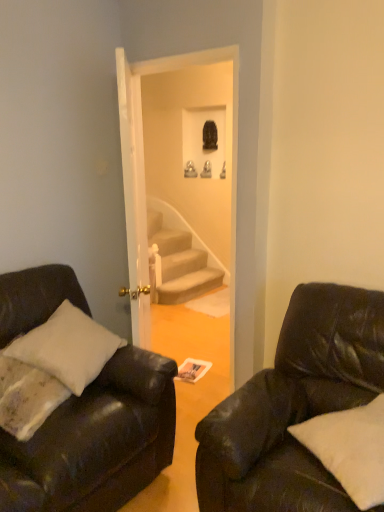
Question: From the image's perspective, would you say matte black couch at left, the 1th studio couch from the left, is shown under black leather couch at right, the first studio couch from the right?

Choices:
 (A) no
 (B) yes

Answer: (A)

Question: Considering the relative sizes of matte black couch at left, the 2th studio couch when ordered from right to left, and black leather couch at right, acting as the 2th studio couch starting from the left, in the image provided, is matte black couch at left, the 2th studio couch when ordered from right to left, wider than black leather couch at right, acting as the 2th studio couch starting from the left,?

Choices:
 (A) no
 (B) yes

Answer: (A)

Question: Would you say matte black couch at left, the 1th studio couch from the left, is outside black leather couch at right, the first studio couch from the right?

Choices:
 (A) no
 (B) yes

Answer: (B)

Question: Can you confirm if matte black couch at left, the 2th studio couch when ordered from right to left, is shorter than black leather couch at right, acting as the 2th studio couch starting from the left?

Choices:
 (A) yes
 (B) no

Answer: (B)

Question: Is matte black couch at left, the 1th studio couch from the left, smaller than black leather couch at right, the first studio couch from the right?

Choices:
 (A) yes
 (B) no

Answer: (B)

Question: From the image's perspective, is black leather couch at right, acting as the 2th studio couch starting from the left, located above or below matte black couch at left, the 2th studio couch when ordered from right to left?

Choices:
 (A) below
 (B) above

Answer: (A)

Question: Considering the positions of point (369, 351) and point (13, 446), is point (369, 351) closer or farther from the camera than point (13, 446)?

Choices:
 (A) closer
 (B) farther

Answer: (B)

Question: Which is correct: black leather couch at right, acting as the 2th studio couch starting from the left, is inside matte black couch at left, the 1th studio couch from the left, or outside of it?

Choices:
 (A) outside
 (B) inside

Answer: (A)

Question: From a real-world perspective, is black leather couch at right, the first studio couch from the right, positioned above or below matte black couch at left, the 1th studio couch from the left?

Choices:
 (A) above
 (B) below

Answer: (B)

Question: Considering the positions of white soft pillow at lower right and black leather couch at right, the first studio couch from the right, in the image, is white soft pillow at lower right bigger or smaller than black leather couch at right, the first studio couch from the right,?

Choices:
 (A) big
 (B) small

Answer: (B)

Question: Looking at their shapes, would you say white soft pillow at lower right is wider or thinner than black leather couch at right, the first studio couch from the right?

Choices:
 (A) wide
 (B) thin

Answer: (B)

Question: Relative to black leather couch at right, the first studio couch from the right, is white soft pillow at lower right in front or behind?

Choices:
 (A) behind
 (B) front

Answer: (A)

Question: From a real-world perspective, is white soft pillow at lower right physically located above or below black leather couch at right, acting as the 2th studio couch starting from the left?

Choices:
 (A) above
 (B) below

Answer: (A)

Question: From their relative heights in the image, would you say black leather couch at right, the first studio couch from the right, is taller or shorter than white soft pillow at lower right?

Choices:
 (A) tall
 (B) short

Answer: (A)

Question: In the image, is black leather couch at right, acting as the 2th studio couch starting from the left, on the left side or the right side of white soft pillow at lower right?

Choices:
 (A) left
 (B) right

Answer: (A)